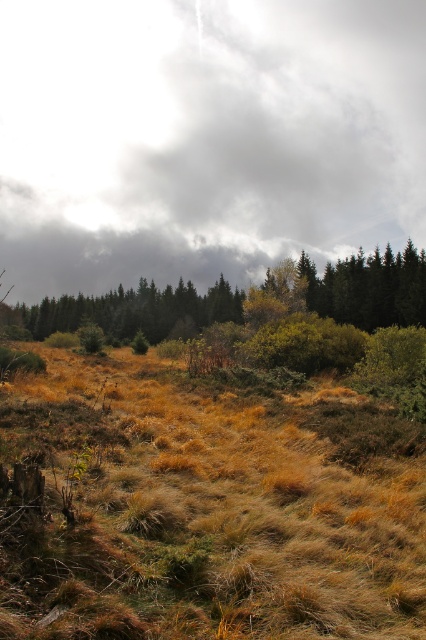
You are standing in the middle of the dry grass at center and looking up at the cloudy sky at upper center. Which object is wider from your perspective?

The cloudy sky at upper center might be wider than the dry grass at center according to the description.

You are standing in the middle of the landscape and want to know the distance between the cloudy sky at upper center and the green matte tree at center. Can you estimate how far apart they are?

The cloudy sky at upper center and the green matte tree at center are 80.99 meters apart.